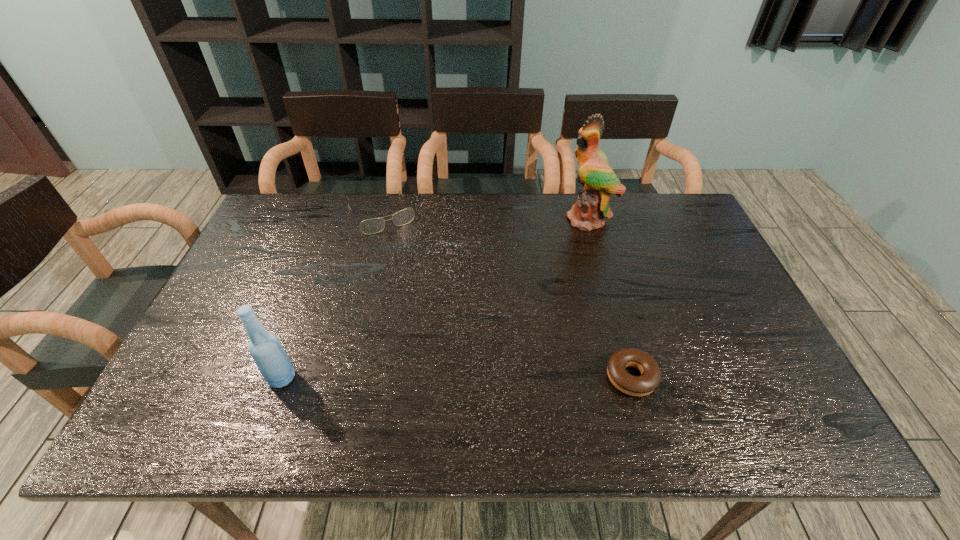
This screenshot has width=960, height=540. In order to click on the second tallest object in this screenshot , I will do `click(265, 348)`.

I want to click on the shortest object, so click(650, 378).

Locate an element on the screen. The image size is (960, 540). the tallest object is located at coordinates click(x=598, y=179).

The width and height of the screenshot is (960, 540). Find the location of `spectacles`. spectacles is located at coordinates (375, 225).

Identify the location of blank area located 0.390m on the back of the third shortest object. The image size is (960, 540). (326, 255).

At what (x,y) coordinates should I click in order to perform the action: click on vacant space located 0.160m on the right of the shortest object. Please return your answer as a coordinate pair (x, y). The height and width of the screenshot is (540, 960). Looking at the image, I should click on (727, 377).

Find the location of `vacant region located 0.190m on the front-facing side of the tallest object`. vacant region located 0.190m on the front-facing side of the tallest object is located at coordinates (x=549, y=263).

This screenshot has height=540, width=960. What are the coordinates of `vacant position located 0.100m on the front-facing side of the tallest object` in the screenshot? It's located at (563, 247).

The image size is (960, 540). What are the coordinates of `vacant space situated on the front-facing side of the tallest object` in the screenshot? It's located at (567, 241).

Find the location of a particular element. The width and height of the screenshot is (960, 540). free space located on the front-facing side of the third tallest object is located at coordinates (426, 288).